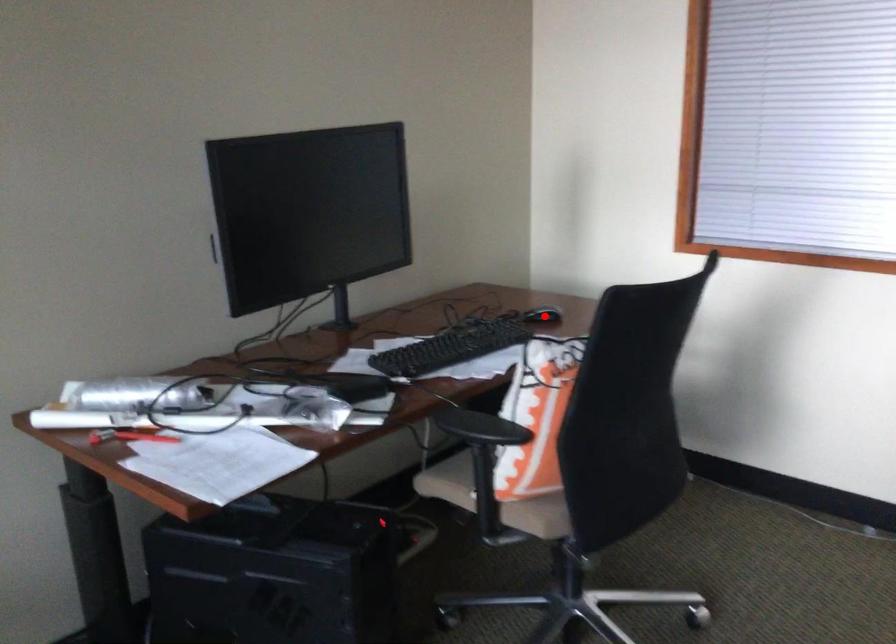
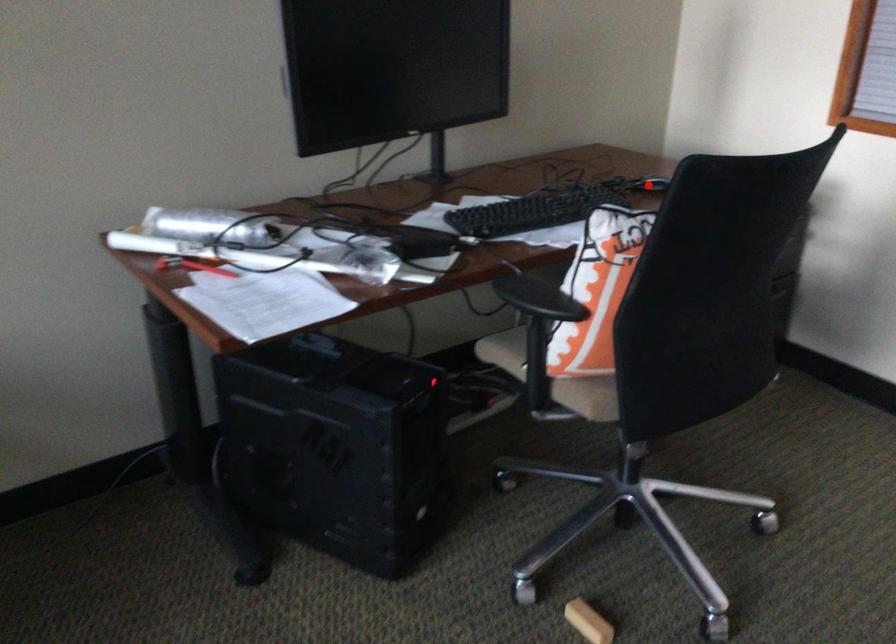
I am providing you with two images of the same scene from different viewpoints. A red point is marked on the first image and another point is marked on the second image. Do the highlighted points in image1 and image2 indicate the same real-world spot?

Yes